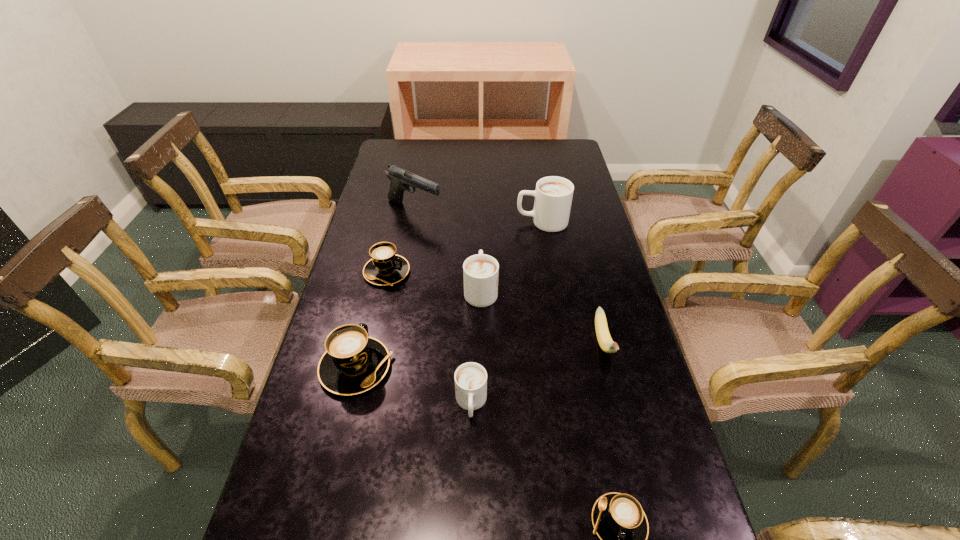
Image resolution: width=960 pixels, height=540 pixels. Find the location of `blank space that satisfies the following two spatial constraints: 1. on the side with the handle of the second smallest white cappuccino; 2. at the muzzle of the black gun`. blank space that satisfies the following two spatial constraints: 1. on the side with the handle of the second smallest white cappuccino; 2. at the muzzle of the black gun is located at coordinates (481, 211).